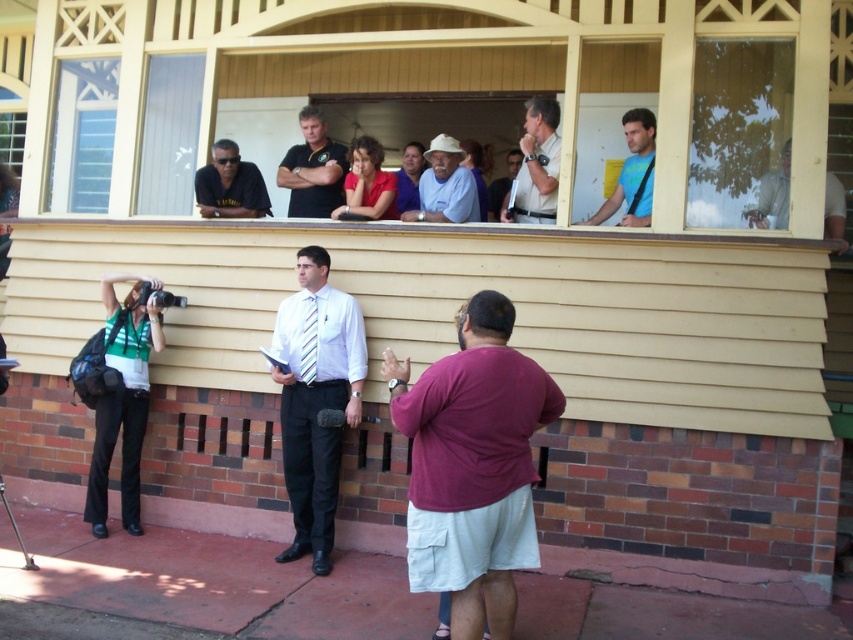
You are standing in front of the building and want to take a photo of the maroon shirt at center and the matte black shirt at upper center. Which one should you focus on first to ensure both are in focus?

You should focus on the maroon shirt at center first because it is closer to the viewer than the matte black shirt at upper center, so focusing on the closer object will help ensure both are in focus.